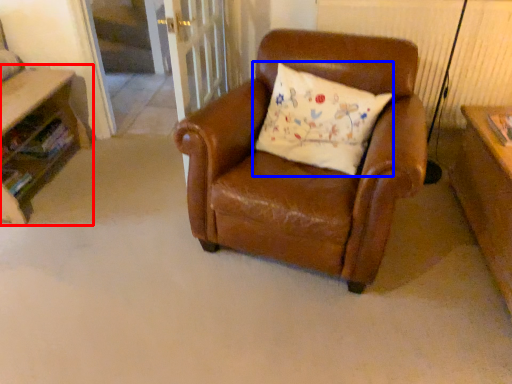
Question: Which object is further to the camera taking this photo, table (highlighted by a red box) or pillow (highlighted by a blue box)?

Choices:
 (A) table
 (B) pillow

Answer: (A)